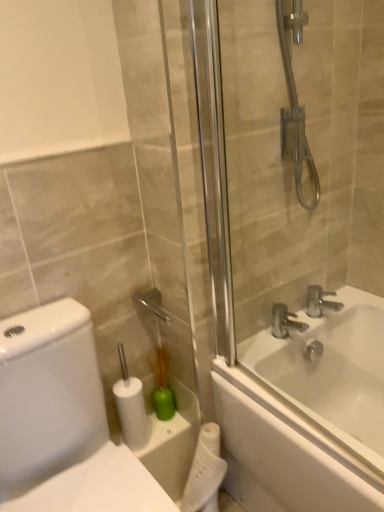
Question: Does white matte toilet paper at lower center, the first toilet paper from the top, have a greater width compared to transparent glass shower door at right?

Choices:
 (A) yes
 (B) no

Answer: (A)

Question: Can you confirm if white matte toilet paper at lower center, the first toilet paper in the left-to-right sequence, is smaller than transparent glass shower door at right?

Choices:
 (A) yes
 (B) no

Answer: (A)

Question: Is white matte toilet paper at lower center, the first toilet paper from the top, not near transparent glass shower door at right?

Choices:
 (A) no
 (B) yes

Answer: (A)

Question: From the image's perspective, is white matte toilet paper at lower center, the first toilet paper from the top, under transparent glass shower door at right?

Choices:
 (A) no
 (B) yes

Answer: (B)

Question: Is white matte toilet paper at lower center, the first toilet paper in the left-to-right sequence, at the left side of transparent glass shower door at right?

Choices:
 (A) no
 (B) yes

Answer: (B)

Question: From a real-world perspective, is silver metallic faucet at upper right, marked as the 2th tap in a left-to-right arrangement, above or below silver metallic faucet at upper right, positioned as the 2th tap in right-to-left order?

Choices:
 (A) above
 (B) below

Answer: (A)

Question: Considering the positions of silver metallic faucet at upper right, marked as the 2th tap in a left-to-right arrangement, and silver metallic faucet at upper right, the 1th tap from the left, in the image, is silver metallic faucet at upper right, marked as the 2th tap in a left-to-right arrangement, wider or thinner than silver metallic faucet at upper right, the 1th tap from the left,?

Choices:
 (A) thin
 (B) wide

Answer: (B)

Question: Is silver metallic faucet at upper right, marked as the 2th tap in a left-to-right arrangement, inside the boundaries of silver metallic faucet at upper right, positioned as the 2th tap in right-to-left order, or outside?

Choices:
 (A) outside
 (B) inside

Answer: (A)

Question: Is silver metallic faucet at upper right, which is the 1th tap in right-to-left order, in front of or behind silver metallic faucet at upper right, positioned as the 2th tap in right-to-left order, in the image?

Choices:
 (A) front
 (B) behind

Answer: (B)

Question: Is white matte toilet paper at lower center, the 2th toilet paper in the bottom-to-top sequence, in front of or behind white glossy toilet at left in the image?

Choices:
 (A) front
 (B) behind

Answer: (B)

Question: Based on their positions, is white matte toilet paper at lower center, the 2th toilet paper in the bottom-to-top sequence, located to the left or right of white glossy toilet at left?

Choices:
 (A) left
 (B) right

Answer: (B)

Question: In terms of height, does white matte toilet paper at lower center, the first toilet paper in the left-to-right sequence, look taller or shorter compared to white glossy toilet at left?

Choices:
 (A) short
 (B) tall

Answer: (A)

Question: From the image's perspective, is white matte toilet paper at lower center, the 2th toilet paper in the bottom-to-top sequence, positioned above or below white glossy toilet at left?

Choices:
 (A) above
 (B) below

Answer: (A)

Question: Considering their positions, is silver metallic faucet at upper right, the 1th tap from the left, located in front of or behind green plastic brush at lower center?

Choices:
 (A) behind
 (B) front

Answer: (A)

Question: Do you think silver metallic faucet at upper right, positioned as the 2th tap in right-to-left order, is within green plastic brush at lower center, or outside of it?

Choices:
 (A) outside
 (B) inside

Answer: (A)